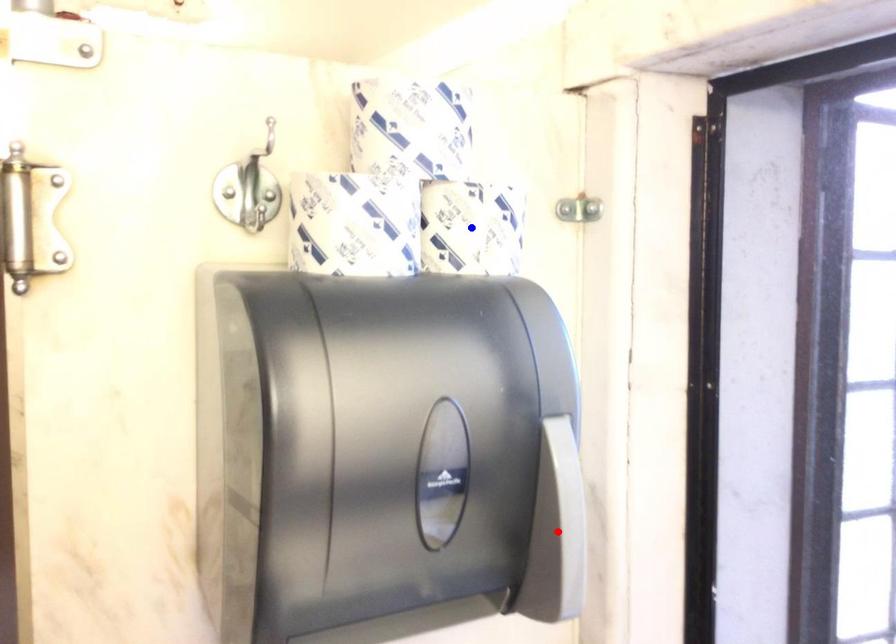
Question: Which of the two points in the image is closer to the camera?

Choices:
 (A) Blue point is closer.
 (B) Red point is closer.

Answer: (B)